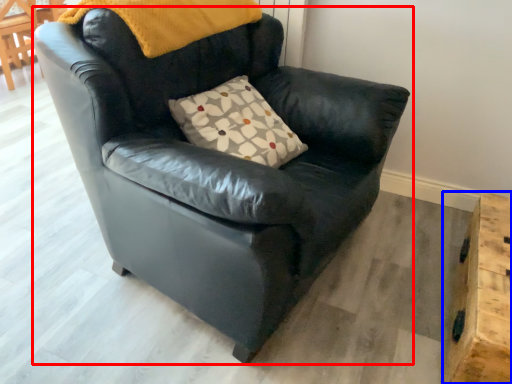
Question: Which object is closer to the camera taking this photo, chair (highlighted by a red box) or table (highlighted by a blue box)?

Choices:
 (A) chair
 (B) table

Answer: (A)